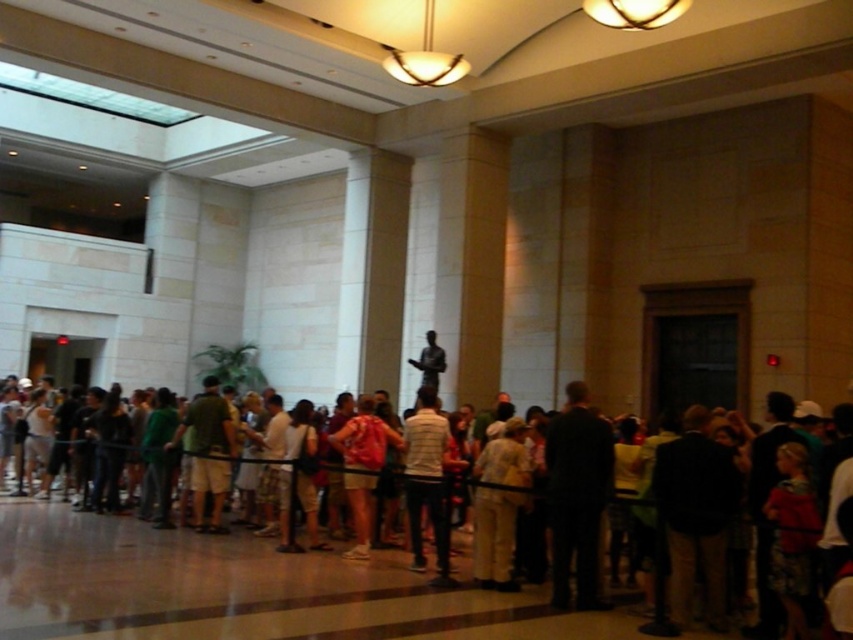
Question: In this image, where is light beige pants at center located relative to white striped shirt at center?

Choices:
 (A) below
 (B) above

Answer: (A)

Question: Does white striped shirt at center have a lesser width compared to red backpack at center?

Choices:
 (A) yes
 (B) no

Answer: (A)

Question: Which point is farther to the camera?

Choices:
 (A) white striped shirt at center
 (B) bronze statue at center
 (C) light beige pants at center

Answer: (B)

Question: Among these objects, which one is nearest to the camera?

Choices:
 (A) bronze statue at center
 (B) light beige pants at center
 (C) red backpack at center
 (D) white striped shirt at center

Answer: (B)

Question: Does light beige pants at center lie in front of white striped shirt at center?

Choices:
 (A) yes
 (B) no

Answer: (A)

Question: Which object is closer to the camera taking this photo?

Choices:
 (A) bronze statue at center
 (B) red backpack at center
 (C) light beige pants at center

Answer: (C)